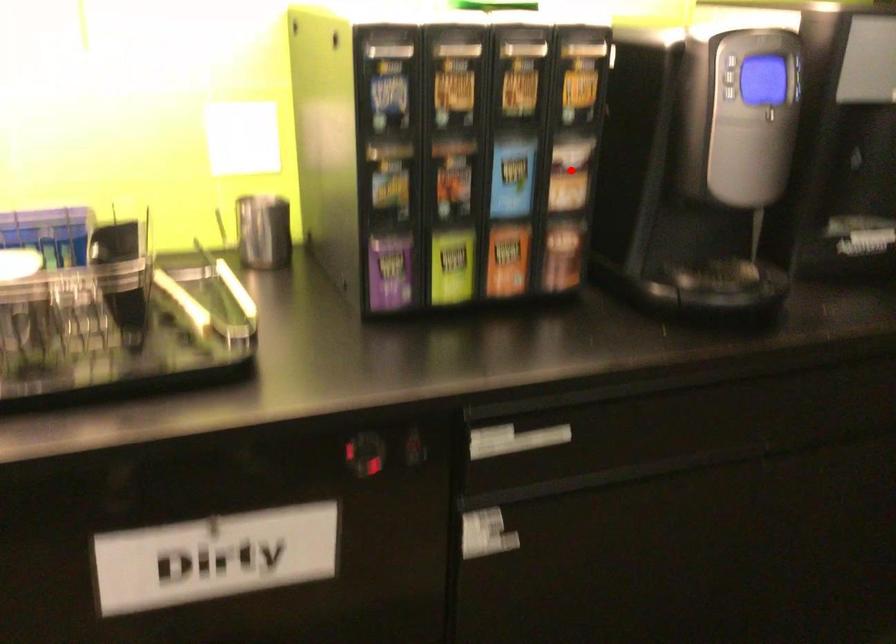
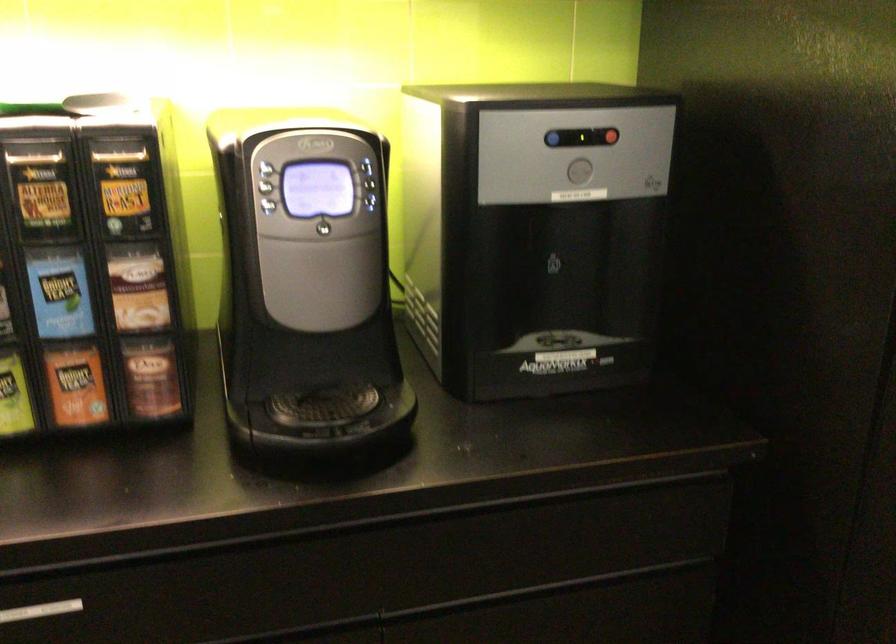
Question: I am providing you with two images of the same scene from different viewpoints. Given a red point in image1, look at the same physical point in image2. Is it:

Choices:
 (A) Closer to the viewpoint
 (B) Farther from the viewpoint

Answer: (A)